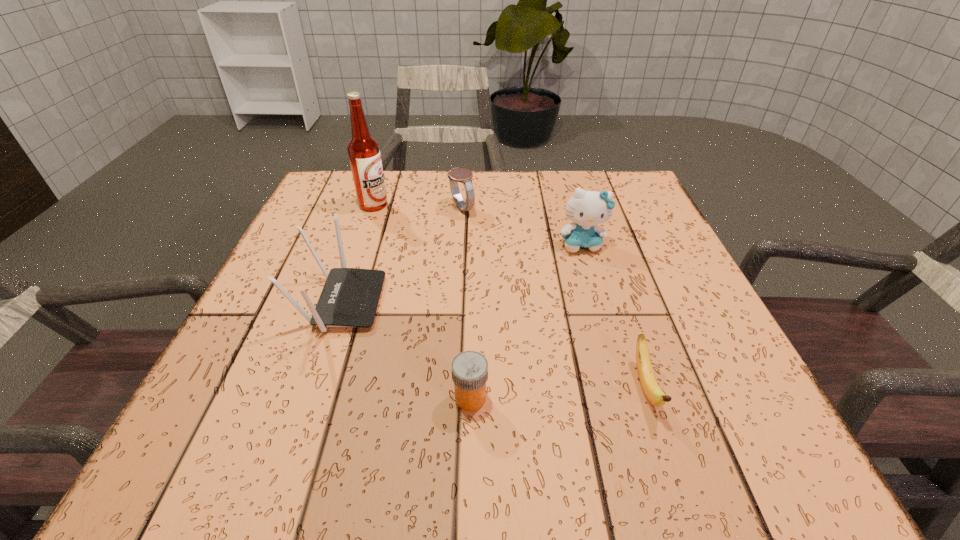
Locate an element on the screen. The image size is (960, 540). vacant space in between the second shortest object and the router is located at coordinates (406, 350).

Identify the location of unoccupied area between the shortest object and the tallest object. (509, 296).

Identify the location of vacant space in between the watch and the tallest object. (418, 206).

Locate an element on the screen. The height and width of the screenshot is (540, 960). the fourth closest object to the medicine is located at coordinates (462, 175).

I want to click on the fifth closest object to the fourth farthest object, so click(655, 395).

This screenshot has width=960, height=540. In order to click on free space that satisfies the following two spatial constraints: 1. on the face of the third farthest object; 2. on the label side of the medicine in this screenshot , I will do `click(626, 398)`.

The image size is (960, 540). Find the location of `vacant region that satisfies the following two spatial constraints: 1. on the label side of the watch; 2. on the left side of the alcohol`. vacant region that satisfies the following two spatial constraints: 1. on the label side of the watch; 2. on the left side of the alcohol is located at coordinates (372, 208).

Identify the location of vacant area in the image that satisfies the following two spatial constraints: 1. on the front side of the fourth tallest object; 2. on the front-facing side of the router. Image resolution: width=960 pixels, height=540 pixels. (457, 302).

At what (x,y) coordinates should I click in order to perform the action: click on free space that satisfies the following two spatial constraints: 1. at the stem of the shortest object; 2. on the label side of the second shortest object. Please return your answer as a coordinate pair (x, y). Looking at the image, I should click on (649, 398).